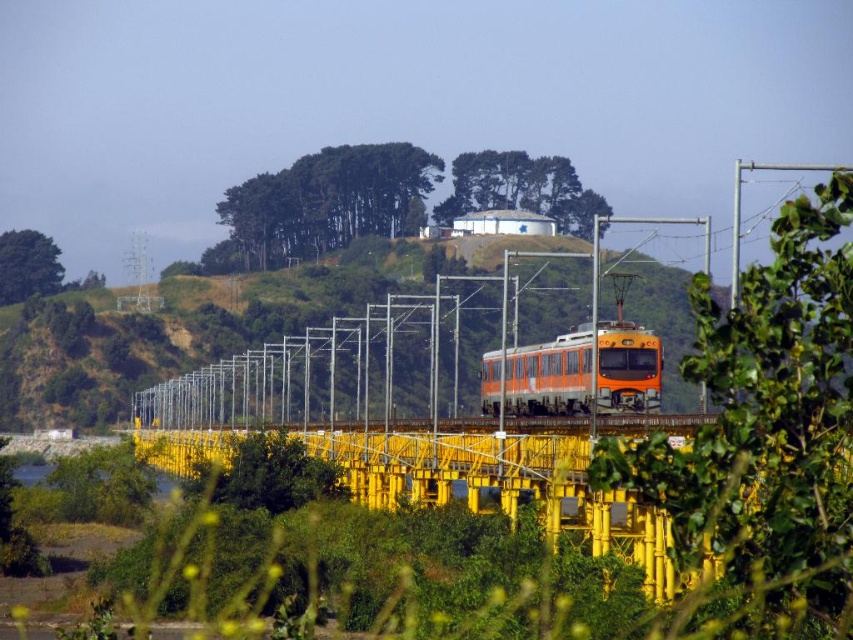
Question: Does green leafy tree at center appear on the right side of green textured water tower at center?

Choices:
 (A) no
 (B) yes

Answer: (A)

Question: Is green leafy trees at upper center closer to camera compared to green leafy tree at upper left?

Choices:
 (A) no
 (B) yes

Answer: (B)

Question: Which point is closer to the camera taking this photo?

Choices:
 (A) (525, 406)
 (B) (13, 285)

Answer: (A)

Question: Which point appears farthest from the camera in this image?

Choices:
 (A) (35, 230)
 (B) (598, 280)

Answer: (A)

Question: Which is nearer to the green leafy tree at upper left?

Choices:
 (A) green grassy hillside at center
 (B) orange matte train at center
 (C) green textured water tower at center
 (D) green leafy trees at upper center

Answer: (D)

Question: Where is green textured water tower at center located in relation to green leafy tree at upper left in the image?

Choices:
 (A) right
 (B) left

Answer: (A)